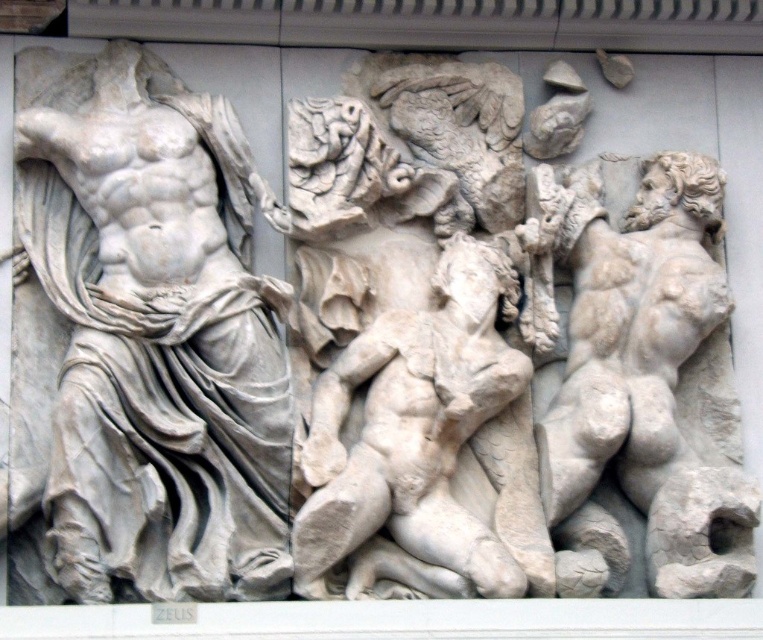
Question: Which object is closer to the camera taking this photo?

Choices:
 (A) white marble torso at left
 (B) white marble muscular figure at right
 (C) white marble nude figure at center

Answer: (A)

Question: Is white marble torso at left thinner than white marble muscular figure at right?

Choices:
 (A) no
 (B) yes

Answer: (A)

Question: Can you confirm if white marble torso at left is smaller than white marble nude figure at center?

Choices:
 (A) yes
 (B) no

Answer: (B)

Question: Considering the real-world distances, which object is farthest from the white marble muscular figure at right?

Choices:
 (A) white marble torso at left
 (B) white marble nude figure at center

Answer: (A)

Question: Can you confirm if white marble torso at left is smaller than white marble muscular figure at right?

Choices:
 (A) no
 (B) yes

Answer: (A)

Question: Which object is the farthest from the white marble nude figure at center?

Choices:
 (A) white marble muscular figure at right
 (B) white marble torso at left

Answer: (B)